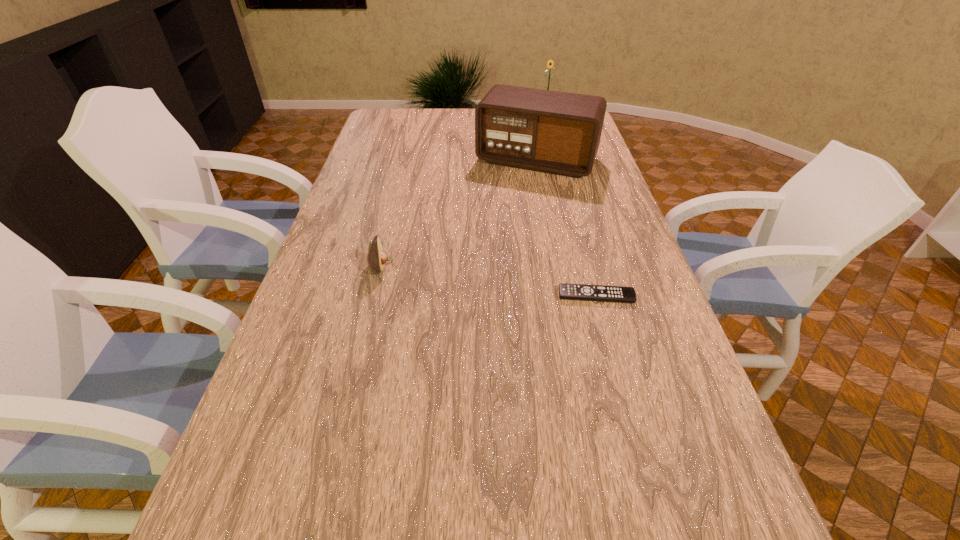
Find the location of a particular element. The width and height of the screenshot is (960, 540). vacant space located on the front-facing side of the radio receiver is located at coordinates (494, 230).

Where is `free space located on the face of the farthest object`? This screenshot has height=540, width=960. free space located on the face of the farthest object is located at coordinates (528, 152).

This screenshot has width=960, height=540. I want to click on free region located on the face of the farthest object, so click(537, 135).

Where is `blank area located 0.050m on the face of the farthest object`? blank area located 0.050m on the face of the farthest object is located at coordinates (541, 125).

This screenshot has height=540, width=960. In order to click on object present at the far edge in this screenshot , I will do `click(550, 63)`.

Find the location of `object positioned at the left edge`. object positioned at the left edge is located at coordinates (377, 257).

You are a GUI agent. You are given a task and a screenshot of the screen. Output one action in this format:
    pyautogui.click(x=<x>, y=<y>)
    Task: Click on the remote control that is positioned at the right edge
    
    Given the screenshot: What is the action you would take?
    pyautogui.click(x=566, y=291)

Locate an element on the screen. The width and height of the screenshot is (960, 540). radio receiver located at the right edge is located at coordinates (554, 132).

This screenshot has width=960, height=540. I want to click on sunflower located at the right edge, so click(550, 63).

The image size is (960, 540). Identify the location of object at the far right corner. (550, 63).